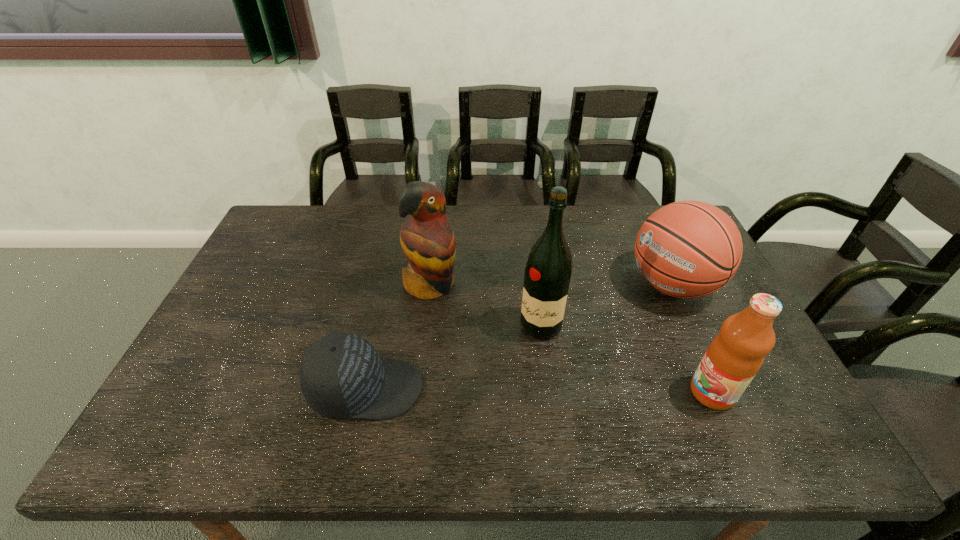
You are a GUI agent. You are given a task and a screenshot of the screen. Output one action in this format:
    pyautogui.click(x=<x>, y=<y>)
    Task: Click on the empty space that is in between the shortest object and the basketball
    
    Given the screenshot: What is the action you would take?
    pyautogui.click(x=519, y=336)

You are a GUI agent. You are given a task and a screenshot of the screen. Output one action in this format:
    pyautogui.click(x=<x>, y=<y>)
    Task: Click on the blank region between the baseball cap and the basketball
    
    Given the screenshot: What is the action you would take?
    pyautogui.click(x=519, y=336)

Find the location of a particular element. The width and height of the screenshot is (960, 540). free space between the fruit juice and the second tallest object is located at coordinates point(571,339).

Where is `empty space that is in between the third object from left to right and the shortest object`? This screenshot has height=540, width=960. empty space that is in between the third object from left to right and the shortest object is located at coordinates (453, 357).

Where is `vacant area that lies between the baseball cap and the basketball`? This screenshot has height=540, width=960. vacant area that lies between the baseball cap and the basketball is located at coordinates (519, 336).

Locate an element on the screen. unoccupied position between the baseball cap and the third object from right to left is located at coordinates (453, 357).

Where is `free area in between the basketball and the third object from left to right`? free area in between the basketball and the third object from left to right is located at coordinates (607, 305).

Find the location of a particular element. vacant area that lies between the fruit juice and the baseball cap is located at coordinates (539, 390).

You are a GUI agent. You are given a task and a screenshot of the screen. Output one action in this format:
    pyautogui.click(x=<x>, y=<y>)
    Task: Click on the object that is the second closest to the shortest object
    
    Given the screenshot: What is the action you would take?
    pyautogui.click(x=548, y=270)

Point out which object is positioned as the second nearest to the fruit juice. Please provide its 2D coordinates. Your answer should be formatted as a tuple, i.e. [(x, y)], where the tuple contains the x and y coordinates of a point satisfying the conditions above.

[(548, 270)]